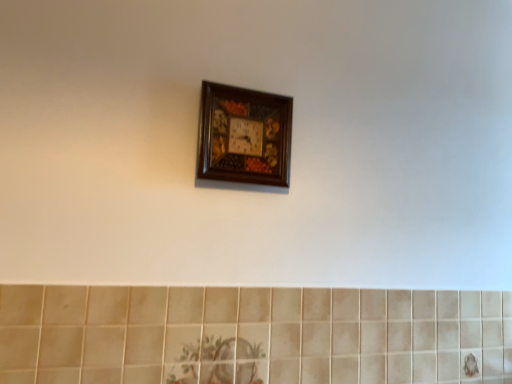
Question: Considering the relative sizes of beige ceramic tile at lower center and wooden clock at upper center in the image provided, is beige ceramic tile at lower center wider than wooden clock at upper center?

Choices:
 (A) yes
 (B) no

Answer: (B)

Question: From a real-world perspective, is beige ceramic tile at lower center located beneath wooden clock at upper center?

Choices:
 (A) yes
 (B) no

Answer: (A)

Question: Are beige ceramic tile at lower center and wooden clock at upper center far apart?

Choices:
 (A) no
 (B) yes

Answer: (A)

Question: Is beige ceramic tile at lower center smaller than wooden clock at upper center?

Choices:
 (A) no
 (B) yes

Answer: (A)

Question: Does beige ceramic tile at lower center have a larger size compared to wooden clock at upper center?

Choices:
 (A) yes
 (B) no

Answer: (A)

Question: Is beige ceramic tile at lower center to the right of wooden clock at upper center from the viewer's perspective?

Choices:
 (A) yes
 (B) no

Answer: (A)

Question: Does wooden clock at upper center have a greater width compared to beige ceramic tile at lower center?

Choices:
 (A) no
 (B) yes

Answer: (B)

Question: Is wooden clock at upper center closer to camera compared to beige ceramic tile at lower center?

Choices:
 (A) no
 (B) yes

Answer: (A)

Question: Is wooden clock at upper center looking in the opposite direction of beige ceramic tile at lower center?

Choices:
 (A) no
 (B) yes

Answer: (A)

Question: From the image's perspective, would you say wooden clock at upper center is shown under beige ceramic tile at lower center?

Choices:
 (A) yes
 (B) no

Answer: (B)

Question: Is beige ceramic tile at lower center located within wooden clock at upper center?

Choices:
 (A) no
 (B) yes

Answer: (A)

Question: From the image's perspective, is wooden clock at upper center on top of beige ceramic tile at lower center?

Choices:
 (A) no
 (B) yes

Answer: (B)

Question: Is beige ceramic tile at lower center inside or outside of wooden clock at upper center?

Choices:
 (A) outside
 (B) inside

Answer: (A)